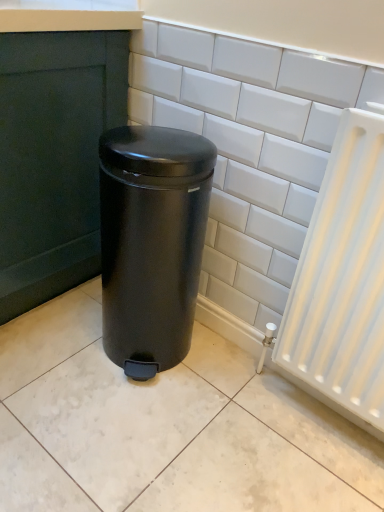
Identify the location of free space to the left of matte black trash can at center. Image resolution: width=384 pixels, height=512 pixels. (56, 335).